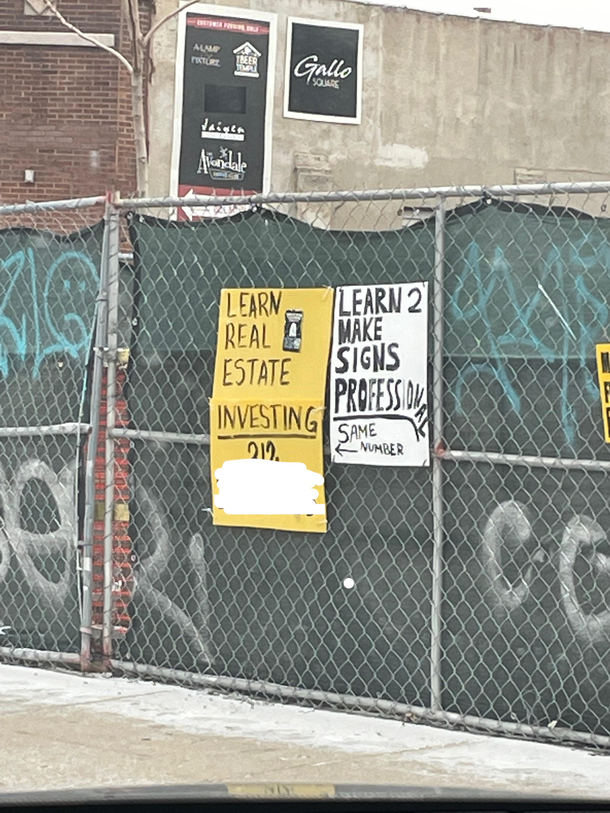
I want to click on wall, so click(449, 133).